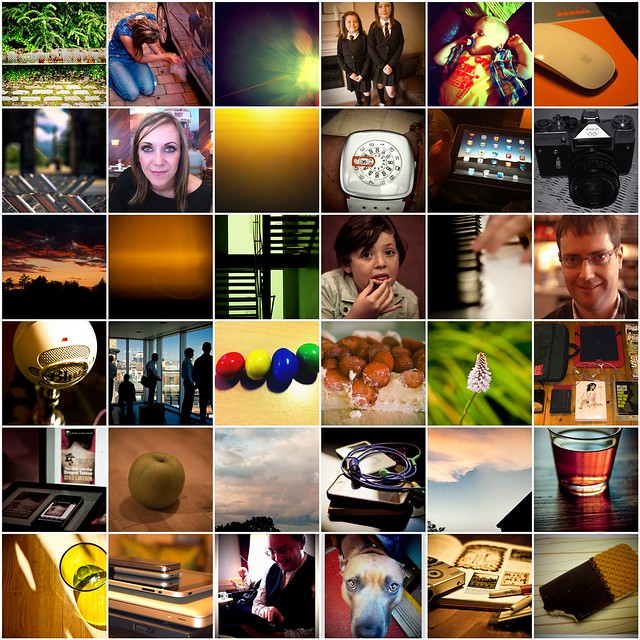
Image resolution: width=640 pixels, height=640 pixels. Identify the location of corner boxes. click(x=591, y=79), click(x=70, y=67), click(x=589, y=577), click(x=81, y=598).